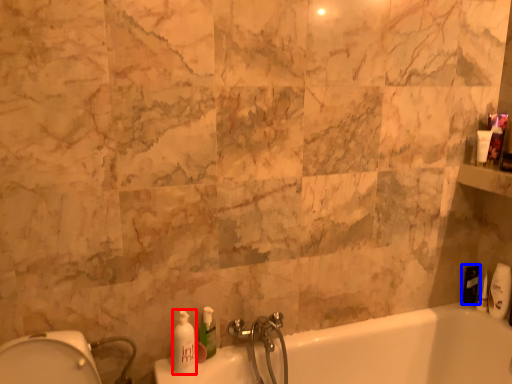
Question: Which point is further to the camera, soap dispenser (highlighted by a red box) or toiletry (highlighted by a blue box)?

Choices:
 (A) soap dispenser
 (B) toiletry

Answer: (B)